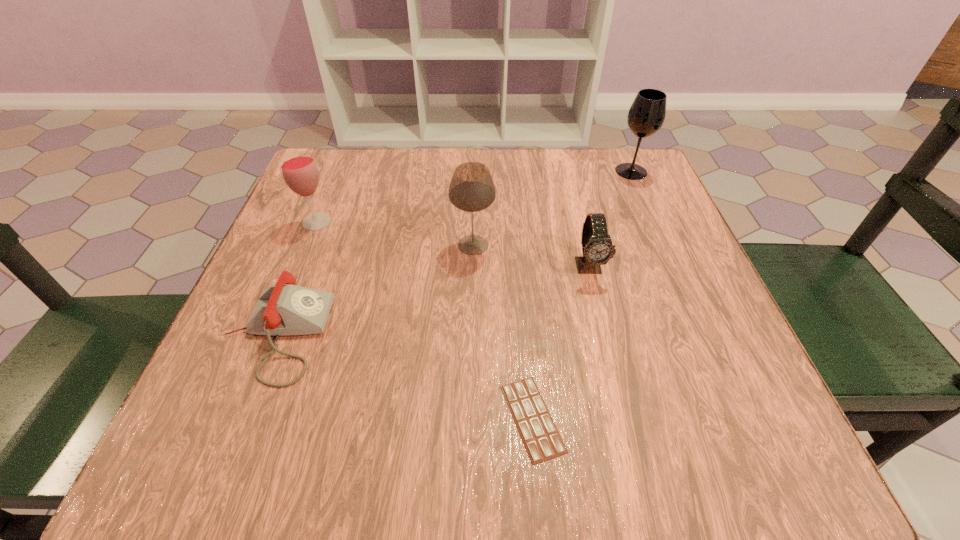
I want to click on vacant point located on the back of the second wineglass from left to right, so click(x=474, y=164).

Locate an element on the screen. vacant space situated on the right of the leftmost wineglass is located at coordinates (502, 222).

I want to click on free space located 0.330m on the face of the third shortest object, so tap(637, 463).

The height and width of the screenshot is (540, 960). I want to click on vacant region located on the dial of the second shortest object, so click(536, 335).

The image size is (960, 540). I want to click on vacant space located 0.050m on the right of the third object from right to left, so click(x=598, y=418).

This screenshot has height=540, width=960. Identify the location of object that is at the far edge. (646, 116).

The image size is (960, 540). What are the coordinates of `object at the near edge` in the screenshot? It's located at (540, 436).

Image resolution: width=960 pixels, height=540 pixels. Identify the location of wineglass that is at the left edge. (299, 170).

Where is `telephone present at the left edge`? telephone present at the left edge is located at coordinates (283, 309).

Locate an element on the screen. The width and height of the screenshot is (960, 540). object that is positioned at the right edge is located at coordinates pos(646,116).